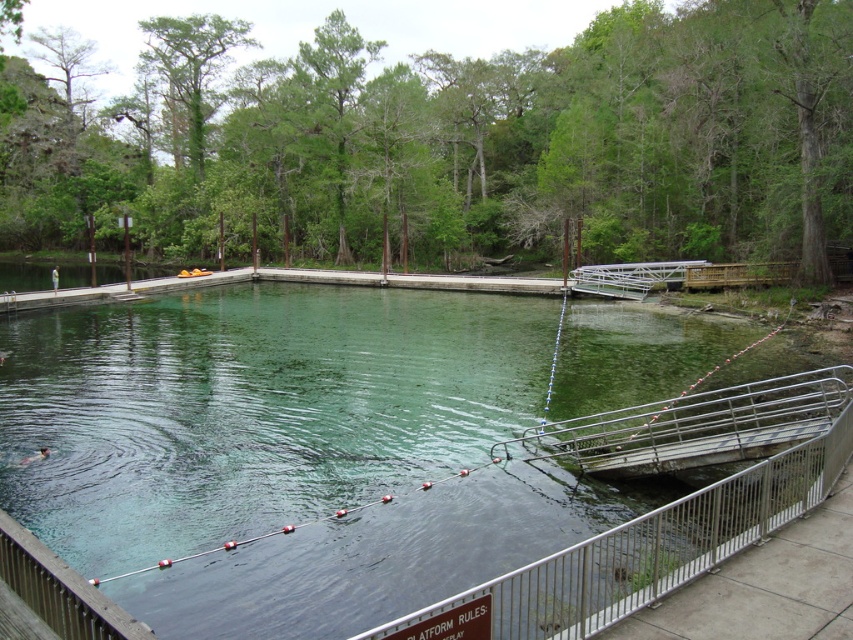
Question: Can you confirm if clear glass pond at center is positioned above metal/rustic rail at lower right?

Choices:
 (A) no
 (B) yes

Answer: (B)

Question: Does clear glass pond at center have a smaller size compared to metal/rustic rail at lower right?

Choices:
 (A) yes
 (B) no

Answer: (B)

Question: Which point is farther to the camera?

Choices:
 (A) (737, 544)
 (B) (590, 580)

Answer: (A)

Question: Among these points, which one is nearest to the camera?

Choices:
 (A) (637, 595)
 (B) (722, 440)

Answer: (A)

Question: Is clear glass pond at center to the left of metal/rustic rail at lower right from the viewer's perspective?

Choices:
 (A) no
 (B) yes

Answer: (A)